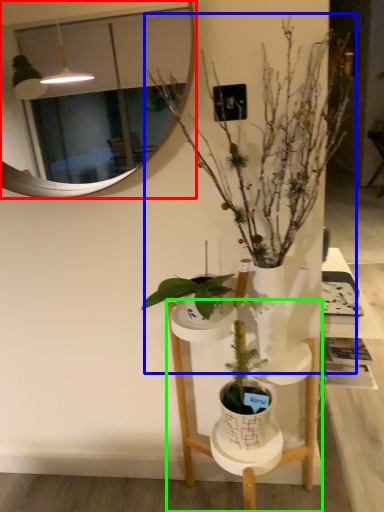
Question: Which is nearer to the mirror (highlighted by a red box)? houseplant (highlighted by a blue box) or furniture (highlighted by a green box).

Choices:
 (A) houseplant
 (B) furniture

Answer: (A)